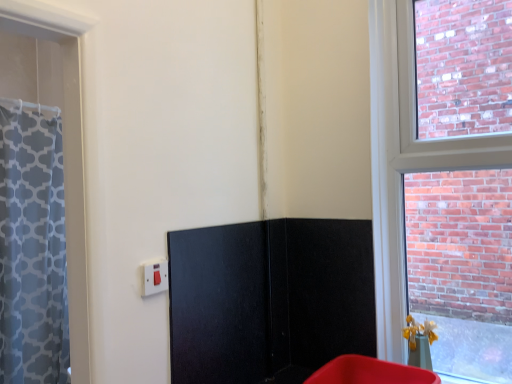
Question: From a real-world perspective, is matte white switch at lower left positioned over black matte screen door at center based on gravity?

Choices:
 (A) no
 (B) yes

Answer: (B)

Question: Is matte white switch at lower left looking in the opposite direction of black matte screen door at center?

Choices:
 (A) no
 (B) yes

Answer: (A)

Question: Does matte white switch at lower left have a greater width compared to black matte screen door at center?

Choices:
 (A) yes
 (B) no

Answer: (B)

Question: Is matte white switch at lower left beside black matte screen door at center?

Choices:
 (A) no
 (B) yes

Answer: (A)

Question: Is matte white switch at lower left further to camera compared to black matte screen door at center?

Choices:
 (A) no
 (B) yes

Answer: (A)

Question: Is matte white switch at lower left bigger than black matte screen door at center?

Choices:
 (A) yes
 (B) no

Answer: (B)

Question: Is black matte screen door at center bigger than matte plastic bin at lower right?

Choices:
 (A) yes
 (B) no

Answer: (B)

Question: Is black matte screen door at center to the left of matte plastic bin at lower right from the viewer's perspective?

Choices:
 (A) no
 (B) yes

Answer: (B)

Question: From a real-world perspective, is black matte screen door at center beneath matte plastic bin at lower right?

Choices:
 (A) no
 (B) yes

Answer: (A)

Question: Is the depth of black matte screen door at center greater than that of matte plastic bin at lower right?

Choices:
 (A) yes
 (B) no

Answer: (A)

Question: Is black matte screen door at center closer to camera compared to matte plastic bin at lower right?

Choices:
 (A) no
 (B) yes

Answer: (A)

Question: Does black matte screen door at center appear on the right side of matte plastic bin at lower right?

Choices:
 (A) yes
 (B) no

Answer: (B)

Question: Would you say matte white switch at lower left is outside matte plastic bin at lower right?

Choices:
 (A) yes
 (B) no

Answer: (A)